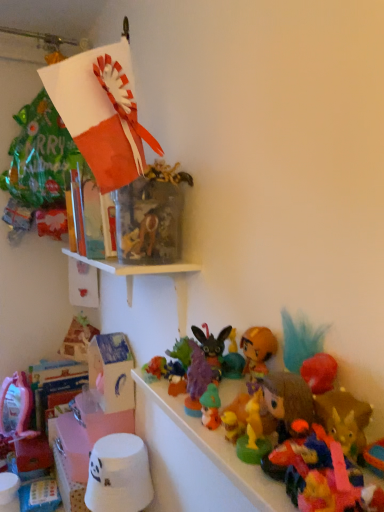
Find the location of `blank space situated above white matte bucket at lower left, arranged as the tenth toy when viewed from the front (from a real-world perspective)`. blank space situated above white matte bucket at lower left, arranged as the tenth toy when viewed from the front (from a real-world perspective) is located at coordinates point(116,444).